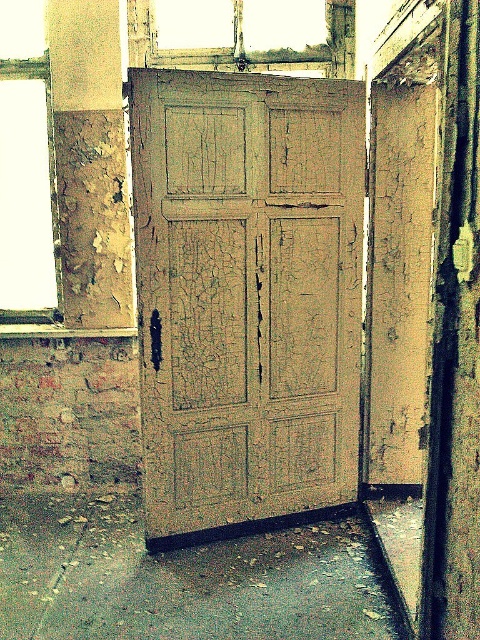
Is cracked wood door at center positioned before wooden frame at upper center?

That is True.

Is cracked wood door at center bigger than wooden frame at upper center?

Indeed, cracked wood door at center has a larger size compared to wooden frame at upper center.

At what (x,y) coordinates should I click in order to perform the action: click on cracked wood door at center. Please return your answer as a coordinate pair (x, y). The width and height of the screenshot is (480, 640). Looking at the image, I should click on (247, 292).

Who is higher up, cracked wood door at center or transparent glass window at upper left?

transparent glass window at upper left

Which is more to the left, cracked wood door at center or transparent glass window at upper left?

Positioned to the left is transparent glass window at upper left.

The width and height of the screenshot is (480, 640). I want to click on cracked wood door at center, so [247, 292].

Between transparent glass window at upper left and wooden frame at upper center, which one has less height?

With less height is wooden frame at upper center.

Based on the photo, does transparent glass window at upper left appear on the left side of wooden frame at upper center?

Indeed, transparent glass window at upper left is positioned on the left side of wooden frame at upper center.

Is point (55, 285) farther from camera compared to point (206, 67)?

That is True.

The height and width of the screenshot is (640, 480). I want to click on transparent glass window at upper left, so click(x=26, y=170).